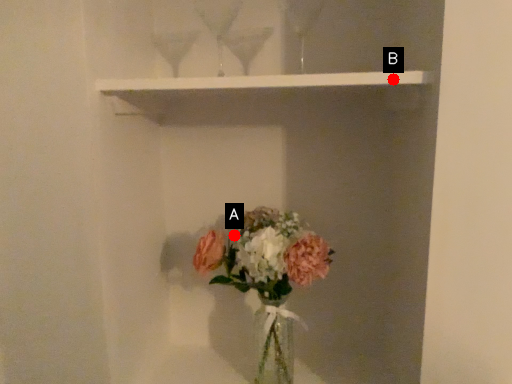
Question: Two points are circled on the image, labeled by A and B beside each circle. Which point is closer to the camera?

Choices:
 (A) A is closer
 (B) B is closer

Answer: (B)